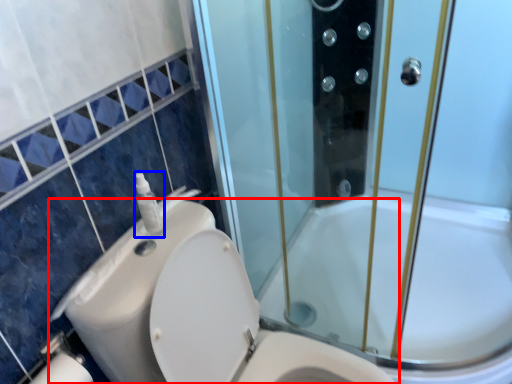
Question: Which of the following is the closest to the observer, toilet (highlighted by a red box) or soap dispenser (highlighted by a blue box)?

Choices:
 (A) toilet
 (B) soap dispenser

Answer: (A)